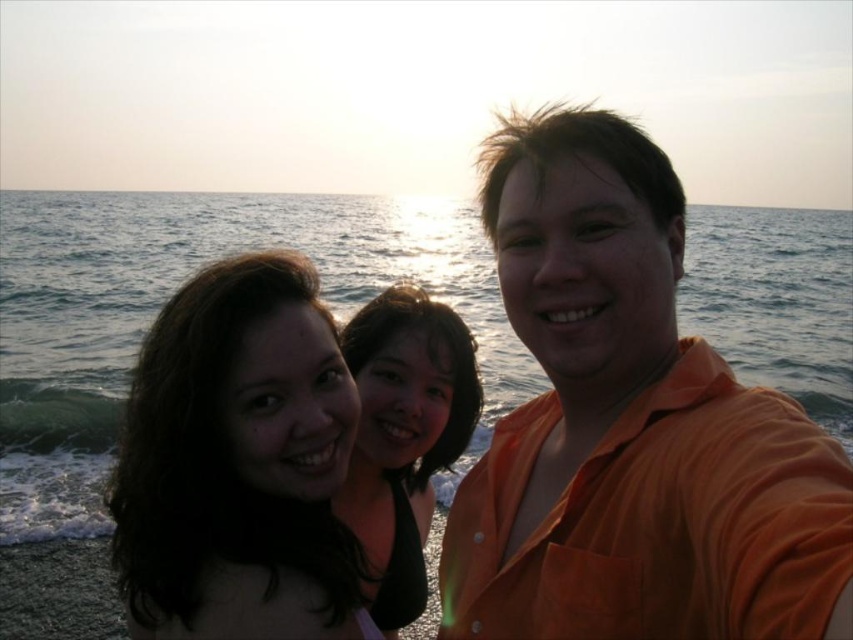
You are taking a photo of two people with dark hair. The scene has a dark brown hair at center and a black matte hair at center. Which one is wider?

The dark brown hair at center is wider than the black matte hair at center according to the description.

You are taking a photo of the orange cotton shirt at right and the black matte hair at center. Which object is located to the right of the other?

The orange cotton shirt at right is positioned on the right side of black matte hair at center.

You are a photographer trying to capture a group photo of the orange cotton shirt at right and the dark brown hair at center. Since you want to ensure both subjects are clearly visible, which subject should you focus on to avoid blurriness due to their size?

The orange cotton shirt at right has a lesser width compared to dark brown hair at center, so you should focus on the dark brown hair at center as it is larger and more prominent in the frame.